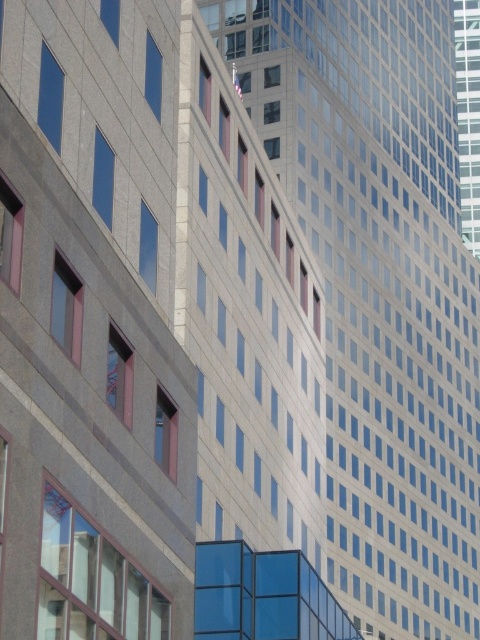
Does smooth glass skyscraper at center appear under glassy reflective skyscraper at upper right?

Yes, smooth glass skyscraper at center is below glassy reflective skyscraper at upper right.

Looking at this image, is smooth glass skyscraper at center taller than glassy reflective skyscraper at upper right?

Correct, smooth glass skyscraper at center is much taller as glassy reflective skyscraper at upper right.

Which is in front, point (412, 572) or point (470, 125)?

Positioned in front is point (412, 572).

This screenshot has width=480, height=640. Identify the location of smooth glass skyscraper at center. (380, 288).